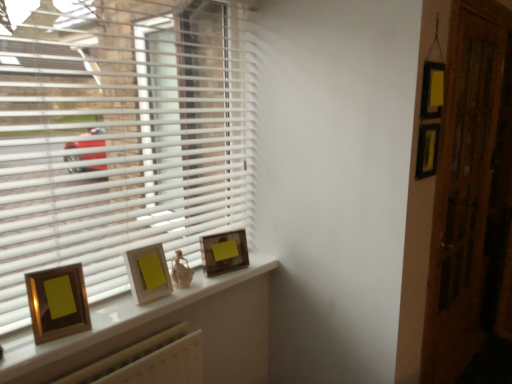
In order to click on vacant area that is in front of wooden glossy picture frame at left, the 1th picture frame viewed from the front in this screenshot , I will do `click(44, 354)`.